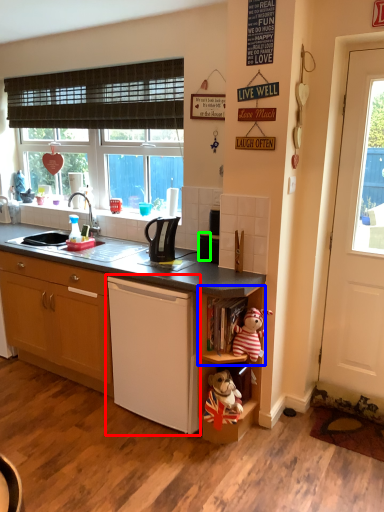
Question: Based on their relative distances, which object is nearer to home appliance (highlighted by a red box)? Choose from shelf (highlighted by a blue box) and appliance (highlighted by a green box).

Choices:
 (A) shelf
 (B) appliance

Answer: (A)